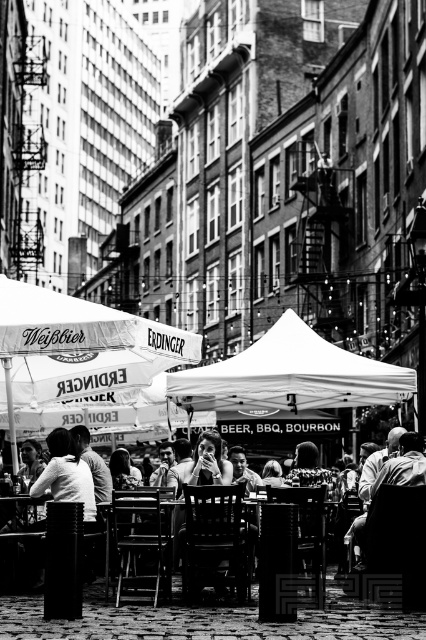
You are a photographer trying to capture a shot of the white fabric canopy at center and the dark hair at lower right. Which object is positioned closer to the camera?

The white fabric canopy at center is closer to the camera than the dark hair at lower right.

You are a photographer standing at the edge of the cobblestone street in the image. You want to take a photo of the dark hair at lower right without including the white fabric canopy at center in the frame. Is it possible to do so by moving your position? Explain your reasoning.

The white fabric canopy at center is located above dark hair at lower right, so moving your position might allow you to angle the camera downward to capture the dark hair at lower right while avoiding the canopy. However, since the canopy is directly above, it may still block part of the view unless you move far enough to the side or back to get a clear angle.

You are standing in the outdoor dining area and want to know how far the point at coordinates [264,369] is from you. Can you determine the distance?

The point at coordinates [264,369] is 54.72 meters away from you.